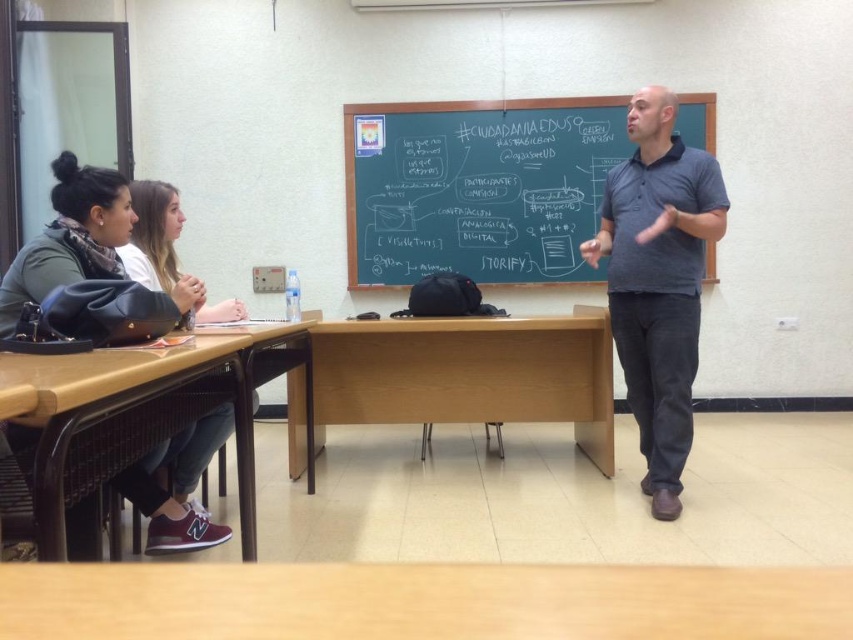
Is wooden table at lower center thinner than green chalkboard at center?

Yes.

Is wooden table at lower center further to the viewer compared to green chalkboard at center?

That is False.

The width and height of the screenshot is (853, 640). Find the location of `wooden table at lower center`. wooden table at lower center is located at coordinates (422, 602).

Is green chalkboard at center below dark blue polo shirt at center?

Actually, green chalkboard at center is above dark blue polo shirt at center.

Which is in front, point (454, 161) or point (672, 236)?

Positioned in front is point (672, 236).

Identify the location of green chalkboard at center. Image resolution: width=853 pixels, height=640 pixels. (477, 188).

Between point (527, 220) and point (383, 372), which one is positioned behind?

The point (527, 220) is more distant.

Which is behind, point (439, 134) or point (453, 404)?

Positioned behind is point (439, 134).

You are a GUI agent. You are given a task and a screenshot of the screen. Output one action in this format:
    pyautogui.click(x=<x>, y=<y>)
    Task: Click on the green chalkboard at center
    The width and height of the screenshot is (853, 640).
    Given the screenshot: What is the action you would take?
    pyautogui.click(x=477, y=188)